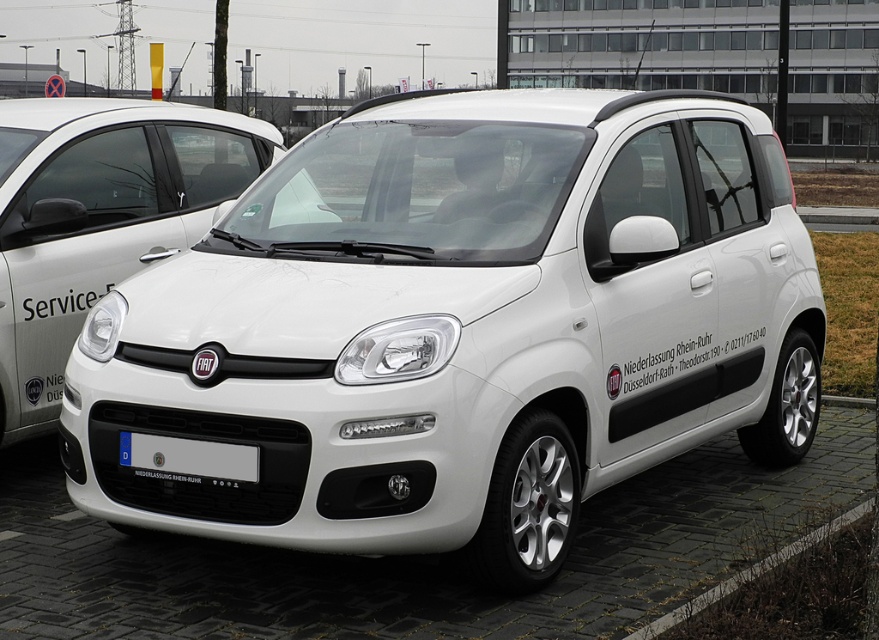
Question: Is white matte fiat car at center bigger than white plastic license plate at center?

Choices:
 (A) no
 (B) yes

Answer: (B)

Question: Which object appears farthest from the camera in this image?

Choices:
 (A) white plastic license plate at center
 (B) white matte fiat car at center

Answer: (B)

Question: Does white matte fiat car at center have a smaller size compared to gray concrete curb at lower right?

Choices:
 (A) yes
 (B) no

Answer: (B)

Question: Which object appears farthest from the camera in this image?

Choices:
 (A) white matte car at center
 (B) gray concrete curb at lower right
 (C) white plastic license plate at center

Answer: (B)

Question: Estimate the real-world distances between objects in this image. Which object is farther from the white matte fiat car at center?

Choices:
 (A) white plastic license plate at center
 (B) gray concrete curb at lower right

Answer: (B)

Question: Is white matte fiat car at center closer to camera compared to gray concrete curb at lower right?

Choices:
 (A) yes
 (B) no

Answer: (B)